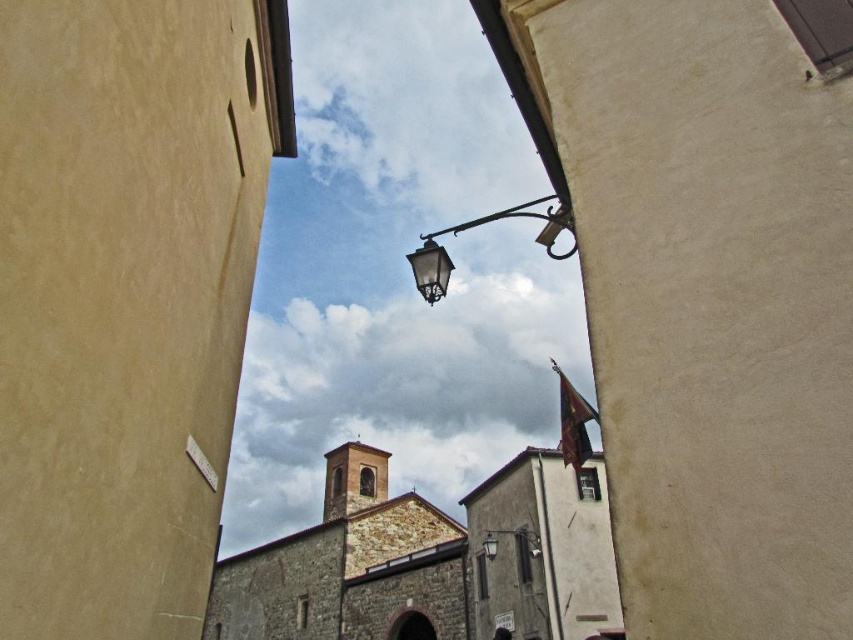
From the picture: Who is more distant from viewer, [461,547] or [421,280]?

The point [461,547] is behind.

Between point (345, 573) and point (426, 266), which one is positioned in front?

Point (426, 266) is more forward.

Where is `brown stone church at center`? This screenshot has height=640, width=853. brown stone church at center is located at coordinates (347, 564).

Does brown stone church at center appear on the left side of metallic streetlamp at center?

Yes, brown stone church at center is to the left of metallic streetlamp at center.

Does brown stone church at center have a smaller size compared to metallic streetlamp at center?

No.

The width and height of the screenshot is (853, 640). Identify the location of brown stone church at center. (347, 564).

Can you confirm if dark gray stone archway at center is thinner than metallic streetlamp at center?

No, dark gray stone archway at center is not thinner than metallic streetlamp at center.

Is dark gray stone archway at center taller than metallic streetlamp at center?

Yes, dark gray stone archway at center is taller than metallic streetlamp at center.

Identify the location of dark gray stone archway at center. This screenshot has width=853, height=640. (410, 627).

Locate an element on the screen. This screenshot has height=640, width=853. dark gray stone archway at center is located at coordinates (410, 627).